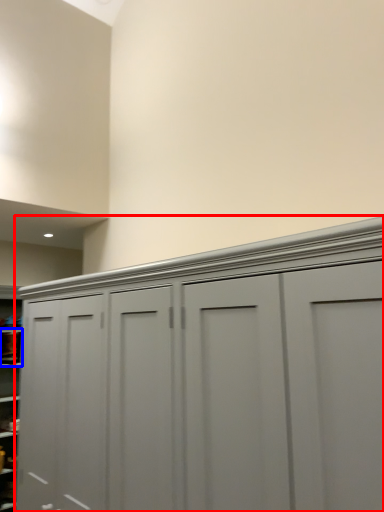
Question: Which of the following is the farthest to the observer, cupboard (highlighted by a red box) or cabinet (highlighted by a blue box)?

Choices:
 (A) cupboard
 (B) cabinet

Answer: (B)